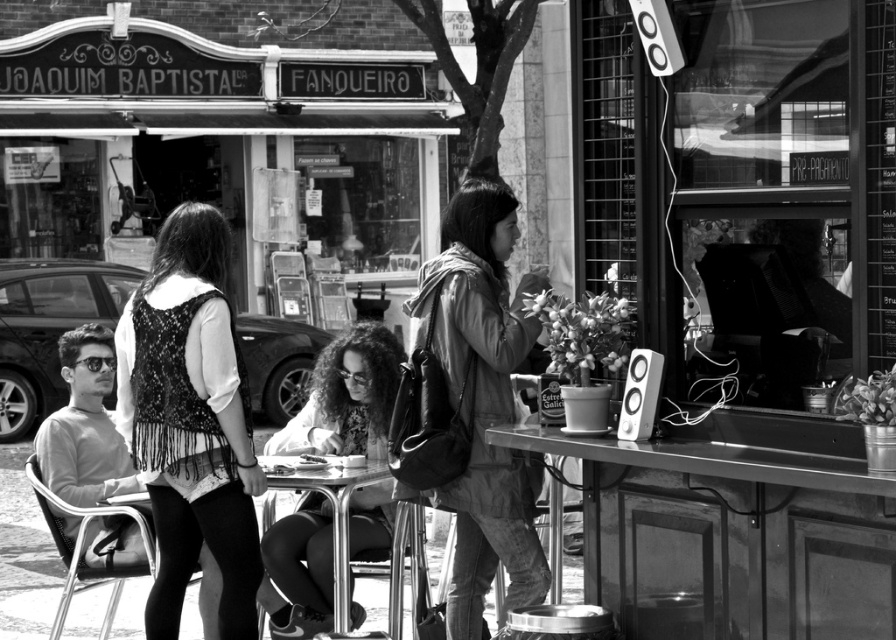
Question: Based on their relative distances, which object is farther from the metallic stainless steel table at lower right?

Choices:
 (A) metallic silver table at center
 (B) leather jacket at center

Answer: (A)

Question: Which point is closer to the camera?

Choices:
 (A) metallic stainless steel table at lower right
 (B) metallic silver table at center

Answer: (A)

Question: Considering the relative positions of smooth gray sweater at left and metallic silver table at center in the image provided, where is smooth gray sweater at left located with respect to metallic silver table at center?

Choices:
 (A) below
 (B) above

Answer: (B)

Question: Can you confirm if metallic stainless steel table at lower right is positioned to the right of smooth gray sweater at left?

Choices:
 (A) no
 (B) yes

Answer: (B)

Question: Is fringed fabric vest at center wider than metallic stainless steel table at lower right?

Choices:
 (A) no
 (B) yes

Answer: (A)

Question: Which object appears farthest from the camera in this image?

Choices:
 (A) leather jacket at center
 (B) metallic silver table at center
 (C) metallic stainless steel table at lower right
 (D) fringed fabric vest at center

Answer: (B)